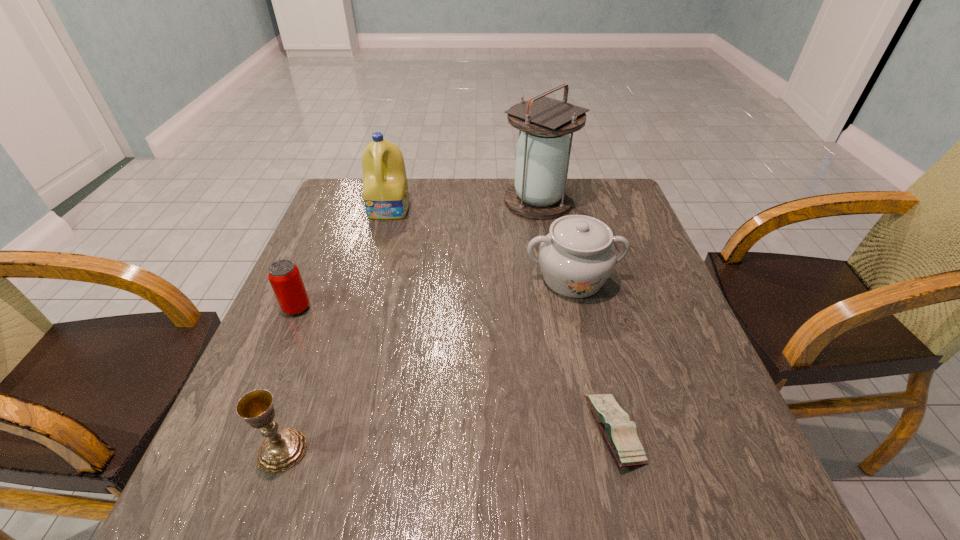
At what (x,y) coordinates should I click in order to perform the action: click on vacant space situated 0.230m on the back of the chalice. Please return your answer as a coordinate pair (x, y). The width and height of the screenshot is (960, 540). Looking at the image, I should click on coord(324,330).

This screenshot has width=960, height=540. Identify the location of blank space located on the front of the second shortest object. (245, 430).

This screenshot has height=540, width=960. Identify the location of vacant space situated on the left of the shortest object. (509, 431).

This screenshot has height=540, width=960. In order to click on lantern at the far edge in this screenshot , I will do `click(543, 150)`.

The height and width of the screenshot is (540, 960). I want to click on detergent at the far edge, so click(385, 190).

Image resolution: width=960 pixels, height=540 pixels. I want to click on chalice that is at the near edge, so click(x=282, y=449).

At what (x,y) coordinates should I click in order to perform the action: click on diary at the near edge. Please return your answer as a coordinate pair (x, y). This screenshot has height=540, width=960. Looking at the image, I should click on (620, 433).

Locate an element on the screen. This screenshot has width=960, height=540. detergent that is at the left edge is located at coordinates (385, 190).

The width and height of the screenshot is (960, 540). Identify the location of chalice located at the left edge. pyautogui.click(x=282, y=449).

This screenshot has width=960, height=540. I want to click on can that is at the left edge, so click(x=284, y=276).